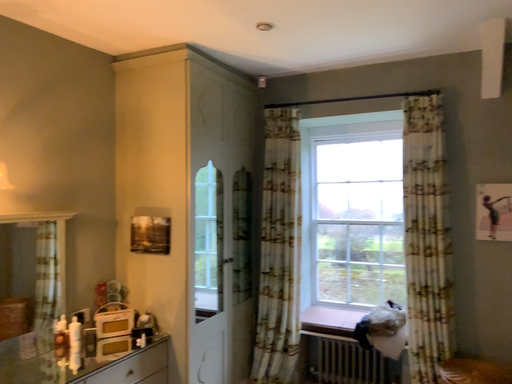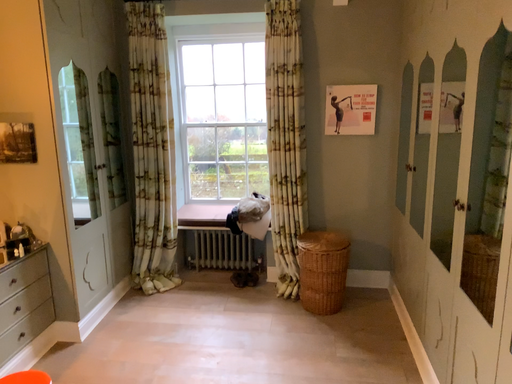
Question: Which way did the camera rotate in the video?

Choices:
 (A) rotated left
 (B) rotated right

Answer: (B)